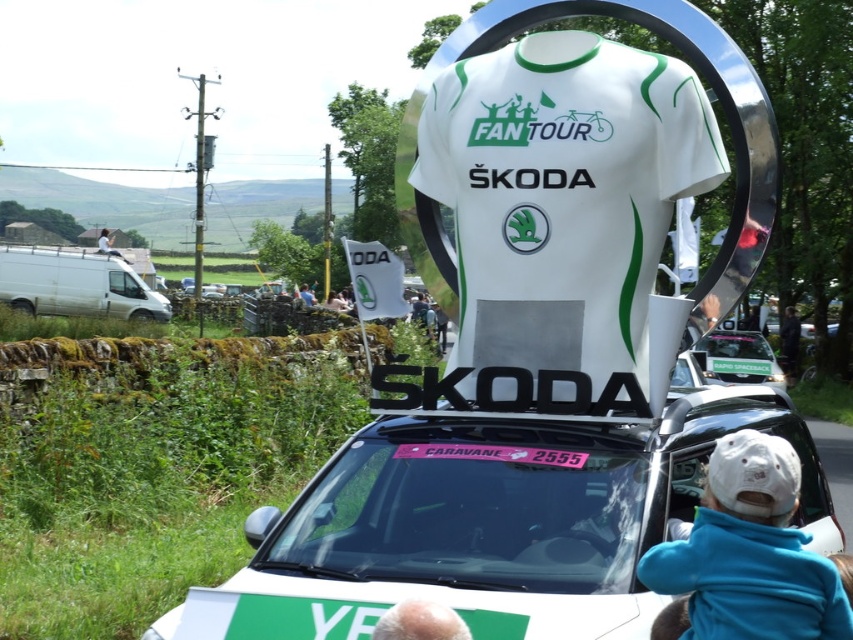
Question: Does white fabric shirt at center lie in front of white fleece jacket at lower right?

Choices:
 (A) yes
 (B) no

Answer: (B)

Question: Does white fabric shirt at center come in front of white glossy sign at center?

Choices:
 (A) no
 (B) yes

Answer: (B)

Question: Which object is closer to the camera taking this photo?

Choices:
 (A) white fleece jacket at lower right
 (B) white fabric shirt at center

Answer: (A)

Question: Among these points, which one is nearest to the camera?

Choices:
 (A) (711, 378)
 (B) (766, 561)

Answer: (B)

Question: Is white glossy car at center positioned in front of white fleece jacket at lower right?

Choices:
 (A) yes
 (B) no

Answer: (B)

Question: Which point is farther from the camera taking this photo?

Choices:
 (A) (740, 365)
 (B) (434, 604)

Answer: (A)